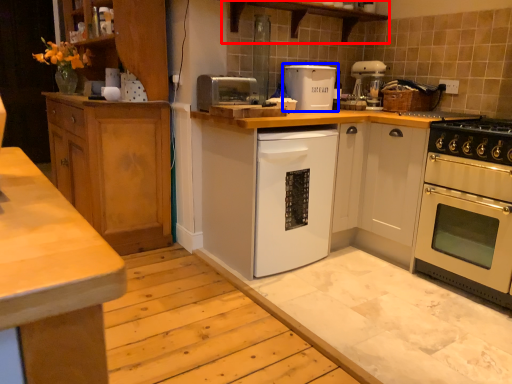
Question: Which object is closer to the camera taking this photo, shelf (highlighted by a red box) or kitchen appliance (highlighted by a blue box)?

Choices:
 (A) shelf
 (B) kitchen appliance

Answer: (A)